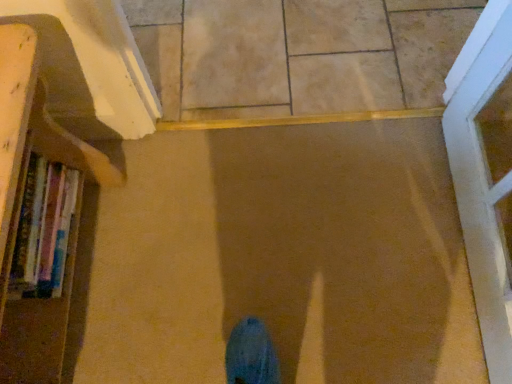
Question: Looking at the image, does hardcover books at left seem bigger or smaller compared to wooden bookshelf at left?

Choices:
 (A) small
 (B) big

Answer: (A)

Question: Considering the positions of hardcover books at left and wooden bookshelf at left in the image, is hardcover books at left wider or thinner than wooden bookshelf at left?

Choices:
 (A) wide
 (B) thin

Answer: (B)

Question: Considering the real-world distances, which object is closest to the hardcover books at left?

Choices:
 (A) beige tile at center
 (B) wooden bookshelf at left

Answer: (B)

Question: Considering the real-world distances, which object is farthest from the hardcover books at left?

Choices:
 (A) wooden bookshelf at left
 (B) beige tile at center

Answer: (B)